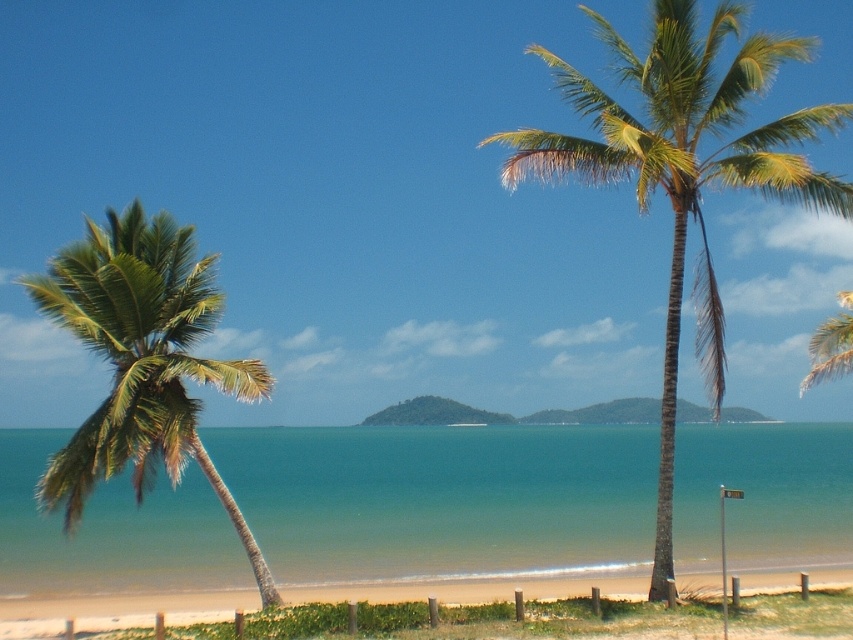
You are standing on the beach and want to take a photo of both the green leafy palm tree at center and the green water at center. Which one should you focus on first to ensure both are in the frame?

You should focus on the green leafy palm tree at center first because it is behind the green water at center, so adjusting the focus to include the background will naturally include the foreground as well.

You are a drone operator trying to capture a photo of the beach scene. The drone is currently at the position of the palm tree leaning slightly towards the left. To get the best shot of the green water at center, should you adjust the drone to move north or south? Please explain your reasoning based on their positions.

The green water at center is located at coordinates point [440,497]. Since the palm tree leaning slightly towards the left is in the foreground and the green water at center is in the middle ground, the drone should move north to capture the green water at center effectively.

In the scene shown: Based on the coordinates provided, which object is located at point (x=142, y=362) in the scene?

The point at (x=142, y=362) corresponds to the green leafy palm tree at left.